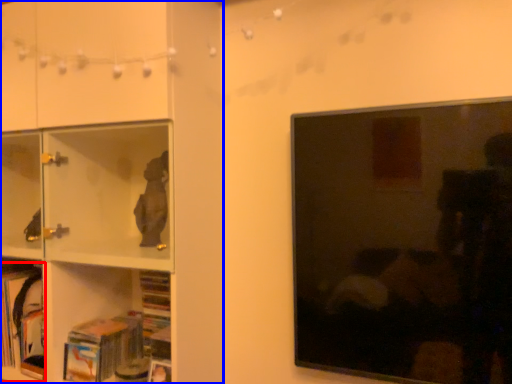
Question: Among these objects, which one is farthest to the camera, book (highlighted by a red box) or shelf (highlighted by a blue box)?

Choices:
 (A) book
 (B) shelf

Answer: (A)